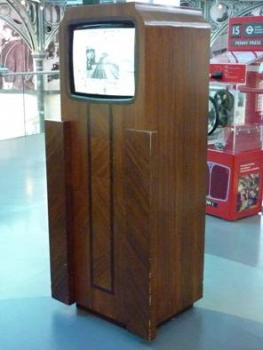
In order to click on wooden box in this screenshot , I will do `click(109, 184)`.